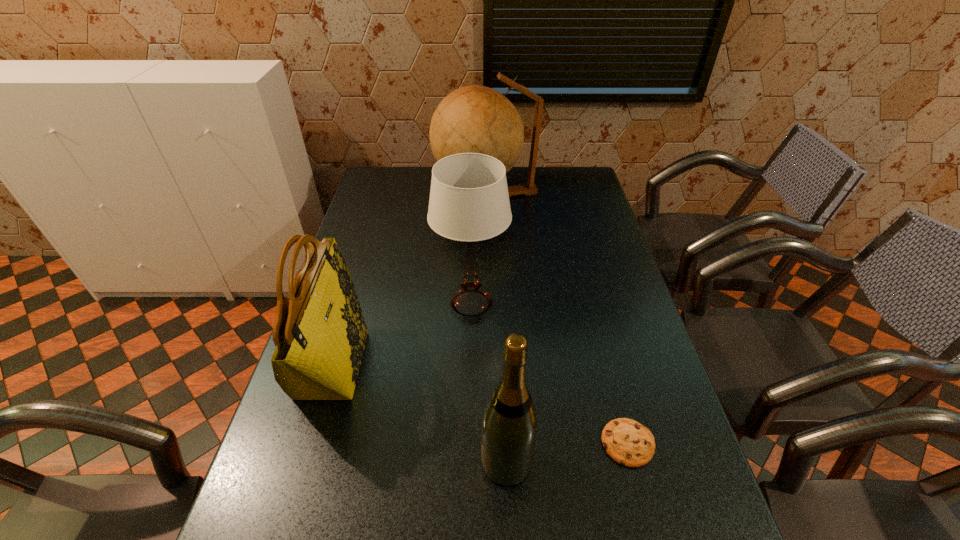
Image resolution: width=960 pixels, height=540 pixels. I want to click on free space located 0.060m on the front-facing side of the wine bottle, so click(x=453, y=462).

Locate an element on the screen. free location located on the front-facing side of the wine bottle is located at coordinates (420, 462).

This screenshot has height=540, width=960. I want to click on vacant space located on the front-facing side of the wine bottle, so click(347, 462).

Identify the location of free region located 0.060m on the front-facing side of the tote bag. The width and height of the screenshot is (960, 540). (384, 364).

Locate an element on the screen. vacant space located on the left of the rightmost object is located at coordinates (476, 443).

At what (x,y) coordinates should I click in order to perform the action: click on object that is at the far edge. Please return your answer as a coordinate pair (x, y). Looking at the image, I should click on (473, 119).

Locate an element on the screen. Image resolution: width=960 pixels, height=540 pixels. object that is positioned at the left edge is located at coordinates (320, 334).

I want to click on object that is at the right edge, so click(x=629, y=443).

Locate an element on the screen. The height and width of the screenshot is (540, 960). vacant area at the far edge is located at coordinates (419, 170).

The height and width of the screenshot is (540, 960). I want to click on free space at the left edge of the desktop, so click(374, 304).